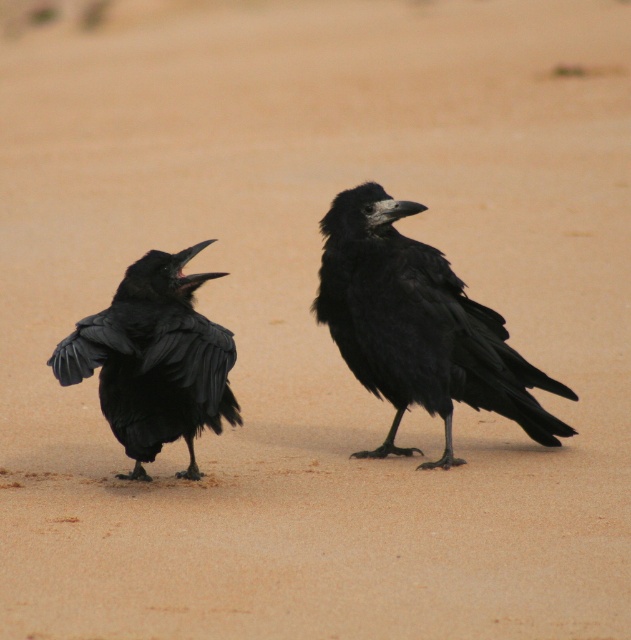
Is shiny black raven at center above shiny black raven at left?

Indeed, shiny black raven at center is positioned over shiny black raven at left.

From the picture: Is shiny black raven at center smaller than shiny black raven at left?

No, shiny black raven at center is not smaller than shiny black raven at left.

The width and height of the screenshot is (631, 640). What are the coordinates of `shiny black raven at center` in the screenshot? It's located at click(x=418, y=324).

The width and height of the screenshot is (631, 640). I want to click on shiny black raven at center, so (x=418, y=324).